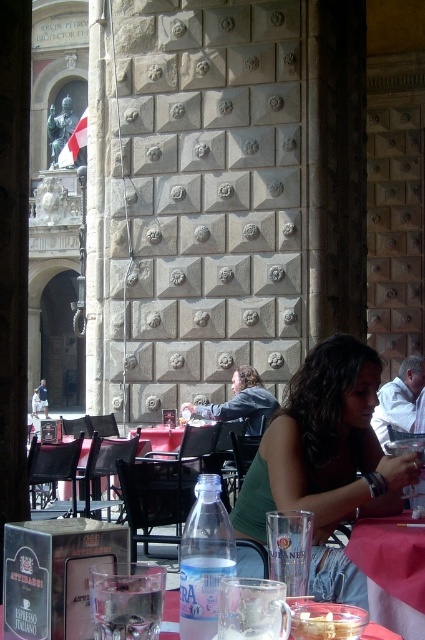
You are standing in front of the stone wall and notice two points marked on it. Which point, point 1 at coordinates (416, 557) or point 2 at (422, 484), is closer to you?

Point 1 at coordinates (416, 557) is closer to the viewer than point 2 at (422, 484).

You are a customer sitting at the table in the image. You want to reach for the translucent glass mug at lower center. Is it obstructed by the green fabric shirt at lower right?

The translucent glass mug at lower center is behind the green fabric shirt at lower right, so it is obstructed and you cannot reach it directly.

You are a waiter at an outdoor cafe and need to place a new order of drinks on the table. The order includes a water bottle and a wine glass. Based on the current arrangement, where should you place the new items to maintain the existing spatial relationship between the transparent plastic bottle at center and the clear glass wine glass at lower right?

You should place the new water bottle above the new wine glass to maintain the existing spatial relationship between the transparent plastic bottle at center and the clear glass wine glass at lower right, as the transparent plastic bottle at center is above the clear glass wine glass at lower right.